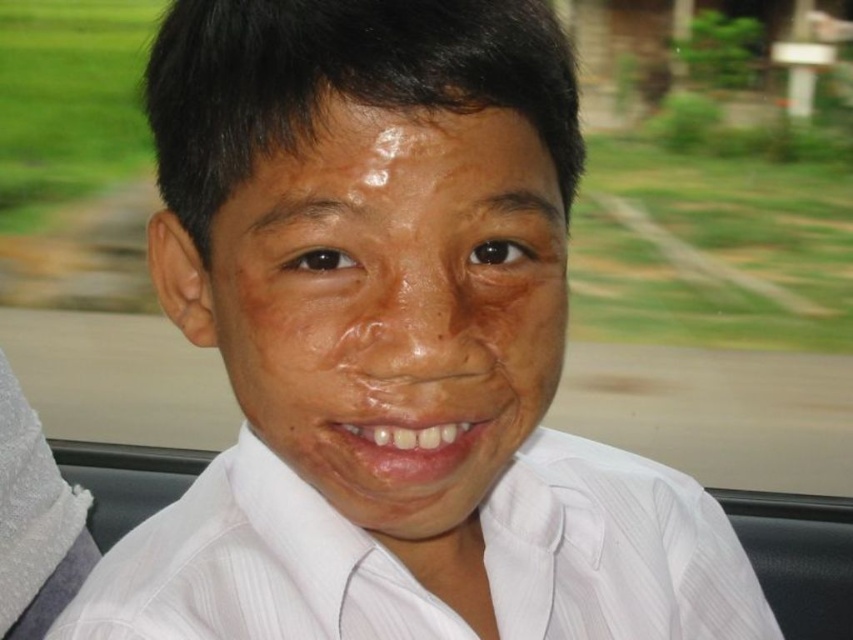
You are a photographer taking a portrait of the person in the vehicle. The subject has a smooth skin face at center and a white striped dress shirt at center. To ensure both the face and shirt are in focus, what is the minimum distance the camera should be set to achieve a depth of field that covers both areas?

The smooth skin face at center and white striped dress shirt at center are 3.46 inches apart. To ensure both are in focus, the camera should be set to a depth of field that can cover at least 3.46 inches between the two subjects.

You are a photographer adjusting the lighting in a vehicle. You need to ensure the white striped dress shirt at center is well lit. Where should you place the light source relative to the point at (252,568)?

The white striped dress shirt at center is located at point (252,568), so the light source should be placed in front of this point to illuminate it effectively.

In the scene shown: You are a medical student observing a patient in a vehicle. You notice the white striped dress shirt at center and dry skin at center. Which object is positioned higher in the image?

The dry skin at center is positioned higher than the white striped dress shirt at center in the image.